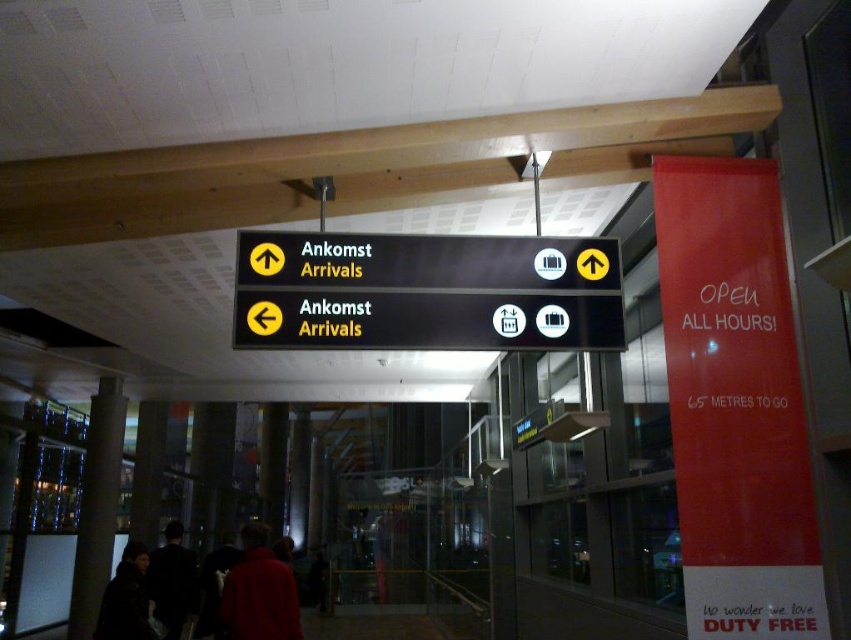
Does black matte sign at center appear over dark brown leather jacket at lower left?

Yes.

Between black matte sign at center and dark brown leather jacket at lower left, which one has more height?

dark brown leather jacket at lower left is taller.

Is point (298, 269) less distant than point (138, 600)?

Yes, it is in front of point (138, 600).

Locate an element on the screen. black matte sign at center is located at coordinates (426, 291).

Can you confirm if red fabric jacket at lower center is smaller than dark brown leather jacket at lower left?

Incorrect, red fabric jacket at lower center is not smaller in size than dark brown leather jacket at lower left.

Is red fabric jacket at lower center closer to camera compared to dark brown leather jacket at lower left?

No, red fabric jacket at lower center is further to the viewer.

Image resolution: width=851 pixels, height=640 pixels. Describe the element at coordinates (260, 592) in the screenshot. I see `red fabric jacket at lower center` at that location.

You are a GUI agent. You are given a task and a screenshot of the screen. Output one action in this format:
    pyautogui.click(x=<x>, y=<y>)
    Task: Click on the red fabric jacket at lower center
    The image size is (851, 640).
    Given the screenshot: What is the action you would take?
    pyautogui.click(x=260, y=592)

Does red fabric jacket at lower center have a greater width compared to dark fabric jacket at center?

Correct, the width of red fabric jacket at lower center exceeds that of dark fabric jacket at center.

Which is more to the right, red fabric jacket at lower center or dark fabric jacket at center?

red fabric jacket at lower center is more to the right.

Is point (254, 637) behind point (157, 563)?

No.

The height and width of the screenshot is (640, 851). I want to click on red fabric jacket at lower center, so click(260, 592).